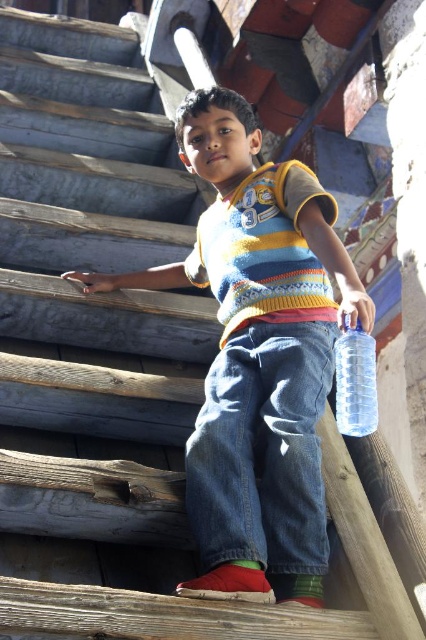
Question: Which point is farther to the camera?

Choices:
 (A) clear plastic bottle at right
 (B) knitted sweater at center

Answer: (A)

Question: Can you confirm if knitted sweater at center is smaller than clear plastic bottle at right?

Choices:
 (A) yes
 (B) no

Answer: (B)

Question: Considering the relative positions of knitted sweater at center and clear plastic bottle at right in the image provided, where is knitted sweater at center located with respect to clear plastic bottle at right?

Choices:
 (A) right
 (B) left

Answer: (B)

Question: Is knitted sweater at center to the left of clear plastic bottle at right from the viewer's perspective?

Choices:
 (A) yes
 (B) no

Answer: (A)

Question: Which point is farther from the camera taking this photo?

Choices:
 (A) [x=245, y=394]
 (B) [x=359, y=372]

Answer: (A)